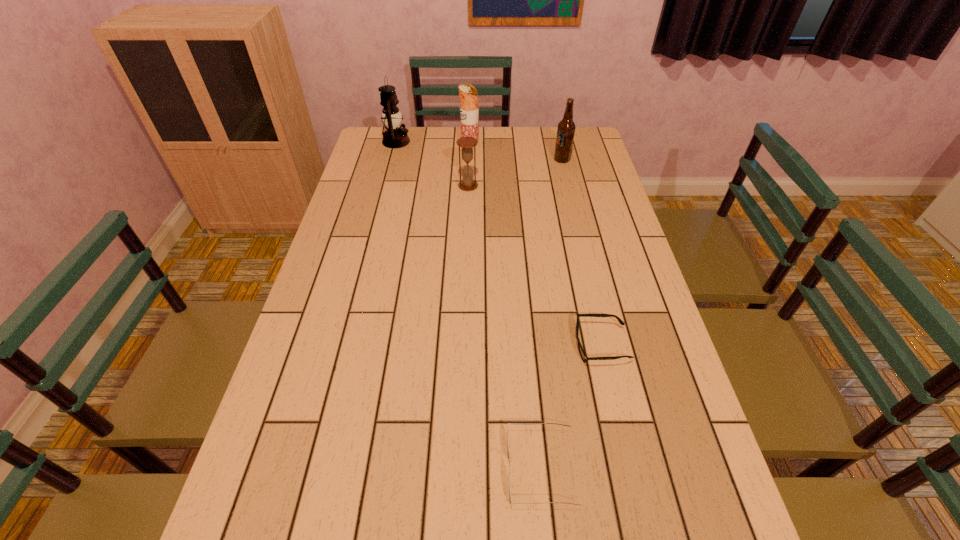
Image resolution: width=960 pixels, height=540 pixels. In order to click on free spot located 0.300m on the front-facing side of the nearest object in this screenshot , I will do `click(353, 469)`.

You are a GUI agent. You are given a task and a screenshot of the screen. Output one action in this format:
    pyautogui.click(x=<x>, y=<y>)
    Task: Click on the lantern that is at the far edge
    The image size is (960, 540).
    Given the screenshot: What is the action you would take?
    pyautogui.click(x=394, y=137)

Identify the location of burrito located at the far edge. This screenshot has height=540, width=960. (469, 111).

You are a GUI agent. You are given a task and a screenshot of the screen. Output one action in this format:
    pyautogui.click(x=<x>, y=<y>)
    Task: Click on the beer bottle that is at the far edge
    The width and height of the screenshot is (960, 540).
    Given the screenshot: What is the action you would take?
    pyautogui.click(x=566, y=128)

Locate an element on the screen. The image size is (960, 540). object positioned at the left edge is located at coordinates (394, 137).

Find the location of a particular element. This screenshot has width=960, height=540. beer bottle at the right edge is located at coordinates (566, 128).

Where is `sunglasses located in the right edge section of the desktop`? The width and height of the screenshot is (960, 540). sunglasses located in the right edge section of the desktop is located at coordinates (584, 357).

Where is `object that is at the far left corner`? Image resolution: width=960 pixels, height=540 pixels. object that is at the far left corner is located at coordinates (394, 137).

I want to click on object present at the far right corner, so click(x=566, y=128).

The width and height of the screenshot is (960, 540). Identify the location of vacant space at the far edge. click(x=521, y=145).